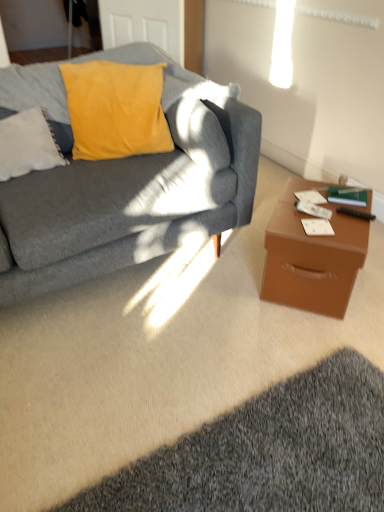
The width and height of the screenshot is (384, 512). I want to click on free space behind black plastic remote control at right, so click(342, 202).